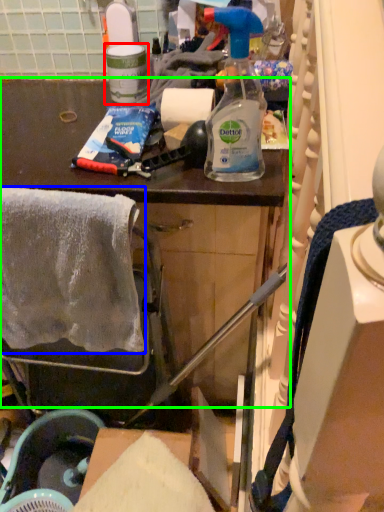
Question: Which is nearer to the bottle (highlighted by a red box)? towel/napkin (highlighted by a blue box) or cabinetry (highlighted by a green box).

Choices:
 (A) towel/napkin
 (B) cabinetry

Answer: (B)